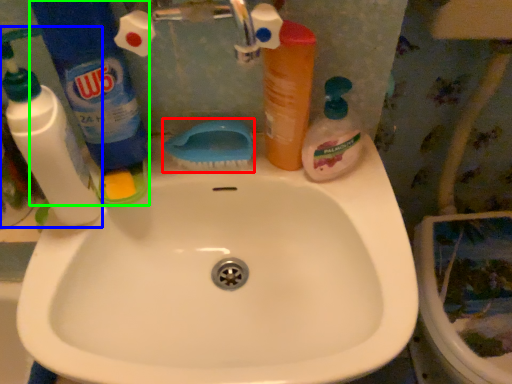
Question: Based on their relative distances, which object is nearer to brush (highlighted by a red box)? Choose from cleaning product (highlighted by a blue box) and cleaning product (highlighted by a green box).

Choices:
 (A) cleaning product
 (B) cleaning product

Answer: (B)